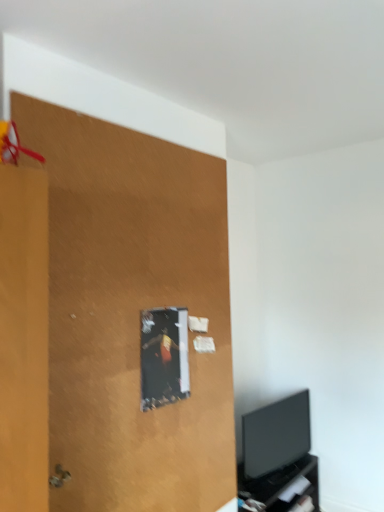
Locate an element on the screen. The height and width of the screenshot is (512, 384). black matte tv cabinet at lower right is located at coordinates (280, 485).

Does matte brown plywood at upper left have a lesser height compared to black glossy tv at lower right?

No.

Is matte brown plywood at upper left aimed at black glossy tv at lower right?

No, matte brown plywood at upper left is not aimed at black glossy tv at lower right.

Considering the positions of point (213, 264) and point (261, 422), is point (213, 264) closer or farther from the camera than point (261, 422)?

Point (213, 264) is closer to the camera than point (261, 422).

From the image's perspective, between matte brown plywood at upper left and black matte tv cabinet at lower right, who is located below?

black matte tv cabinet at lower right, from the image's perspective.

This screenshot has width=384, height=512. What are the coordinates of `tv cabinet directly beneath the matte brown plywood at upper left (from a real-world perspective)` in the screenshot? It's located at click(x=280, y=485).

Considering the relative positions of matte brown plywood at upper left and black matte tv cabinet at lower right in the image provided, is matte brown plywood at upper left behind black matte tv cabinet at lower right?

No, matte brown plywood at upper left is in front of black matte tv cabinet at lower right.

The width and height of the screenshot is (384, 512). Find the location of `entertainment center behind the matte brown plywood at upper left`. entertainment center behind the matte brown plywood at upper left is located at coordinates (278, 457).

From the image's perspective, which one is positioned higher, black glossy tv at lower right or matte brown plywood at upper left?

matte brown plywood at upper left, from the image's perspective.

In the scene shown: Does black glossy tv at lower right have a greater width compared to matte brown plywood at upper left?

Indeed, black glossy tv at lower right has a greater width compared to matte brown plywood at upper left.

Which object is positioned more to the right, black glossy tv at lower right or matte brown plywood at upper left?

black glossy tv at lower right.

Who is smaller, black matte tv cabinet at lower right or matte brown plywood at upper left?

matte brown plywood at upper left is smaller.

Is black matte tv cabinet at lower right facing towards matte brown plywood at upper left?

No, black matte tv cabinet at lower right does not turn towards matte brown plywood at upper left.

Does black matte tv cabinet at lower right come in front of matte brown plywood at upper left?

No, the depth of black matte tv cabinet at lower right is greater than that of matte brown plywood at upper left.

Can you confirm if black matte tv cabinet at lower right is positioned to the left of black glossy tv at lower right?

Correct, you'll find black matte tv cabinet at lower right to the left of black glossy tv at lower right.

Is point (246, 490) in front of point (296, 415)?

Yes, point (246, 490) is in front of point (296, 415).

Is black matte tv cabinet at lower right turned away from black glossy tv at lower right?

That's not correct — black matte tv cabinet at lower right is not looking away from black glossy tv at lower right.

Relative to black glossy tv at lower right, is black matte tv cabinet at lower right in front or behind?

Visually, black matte tv cabinet at lower right is located in front of black glossy tv at lower right.

Between black glossy tv at lower right and black matte tv cabinet at lower right, which one has smaller width?

With smaller width is black glossy tv at lower right.

Does black glossy tv at lower right have a lesser height compared to black matte tv cabinet at lower right?

No, black glossy tv at lower right is not shorter than black matte tv cabinet at lower right.

Which of these two, black glossy tv at lower right or black matte tv cabinet at lower right, is bigger?

black matte tv cabinet at lower right.

Where is `entertainment center below the matte brown plywood at upper left (from a real-world perspective)`? entertainment center below the matte brown plywood at upper left (from a real-world perspective) is located at coordinates (278, 457).

Identify the location of plywood positioned vertically above the black matte tv cabinet at lower right (from a real-world perspective). Image resolution: width=384 pixels, height=512 pixels. (132, 313).

From the image, which object appears to be nearer to black matte tv cabinet at lower right, matte brown plywood at upper left or black glossy tv at lower right?

The object closer to black matte tv cabinet at lower right is black glossy tv at lower right.

From the image, which object appears to be nearer to black glossy tv at lower right, matte brown plywood at upper left or black matte tv cabinet at lower right?

black matte tv cabinet at lower right lies closer to black glossy tv at lower right than the other object.

Which object lies nearer to the anchor point black glossy tv at lower right, black matte tv cabinet at lower right or matte brown plywood at upper left?

black matte tv cabinet at lower right.

From the image, which object appears to be farther from matte brown plywood at upper left, black matte tv cabinet at lower right or black glossy tv at lower right?

black matte tv cabinet at lower right lies further to matte brown plywood at upper left than the other object.

In the scene shown: Which object lies further to the anchor point black matte tv cabinet at lower right, black glossy tv at lower right or matte brown plywood at upper left?

matte brown plywood at upper left lies further to black matte tv cabinet at lower right than the other object.

Estimate the real-world distances between objects in this image. Which object is further from matte brown plywood at upper left, black glossy tv at lower right or black matte tv cabinet at lower right?

Among the two, black matte tv cabinet at lower right is located further to matte brown plywood at upper left.

Where is `entertainment center between matte brown plywood at upper left and black matte tv cabinet at lower right in the vertical direction`? Image resolution: width=384 pixels, height=512 pixels. entertainment center between matte brown plywood at upper left and black matte tv cabinet at lower right in the vertical direction is located at coordinates (278, 457).